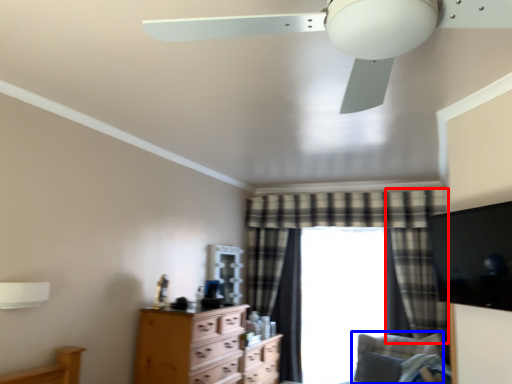
Question: Among these objects, which one is nearest to the camera, curtain (highlighted by a red box) or swivel chair (highlighted by a blue box)?

Choices:
 (A) curtain
 (B) swivel chair

Answer: (B)